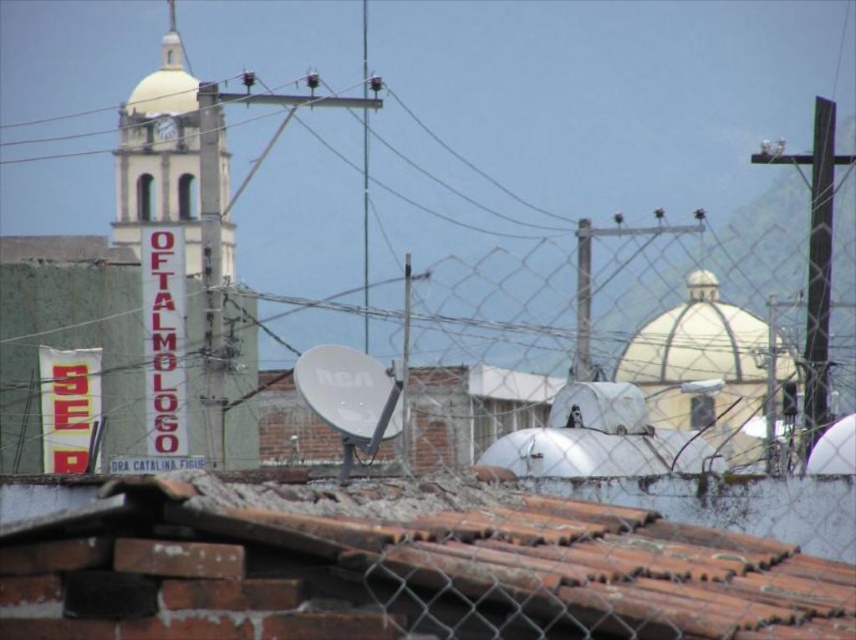
You are a photographer trying to capture the satellite dishes on the rooftop. You notice the dark brown wooden pole at right and the metallic pole at center in your shot. Which pole should you avoid blocking the dishes if you want to keep both poles in the frame?

You should avoid blocking the metallic pole at center because it is larger in size compared to the dark brown wooden pole at right, making it more likely to obstruct the view of the satellite dishes.

What is the 2D coordinate of the white concrete tower at left in the image?

The white concrete tower at left is located at the 2D coordinate point of (x=211, y=268).